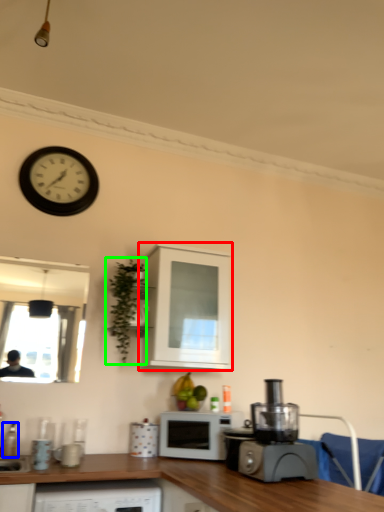
Question: Which is nearer to the cabinetry (highlighted by a red box)? bottle (highlighted by a blue box) or plant (highlighted by a green box).

Choices:
 (A) bottle
 (B) plant

Answer: (B)